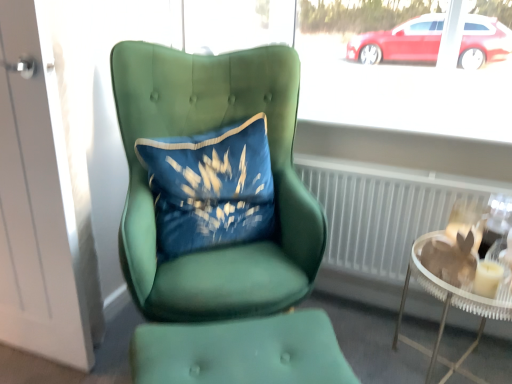
Question: Considering the positions of clear glass table at lower right and green fabric footrest at lower center in the image, is clear glass table at lower right bigger or smaller than green fabric footrest at lower center?

Choices:
 (A) big
 (B) small

Answer: (A)

Question: From the image's perspective, relative to green fabric footrest at lower center, is clear glass table at lower right above or below?

Choices:
 (A) above
 (B) below

Answer: (A)

Question: Which object is positioned closest to the translucent glass candle at right?

Choices:
 (A) velvet green chair at center
 (B) clear glass table at lower right
 (C) green fabric footrest at lower center
 (D) velvet blue pillow at center
 (E) white textured radiator at center

Answer: (B)

Question: Which object is the closest to the white matte door at left?

Choices:
 (A) velvet green chair at center
 (B) green fabric footrest at lower center
 (C) clear glass table at lower right
 (D) translucent glass candle at right
 (E) velvet blue pillow at center

Answer: (E)